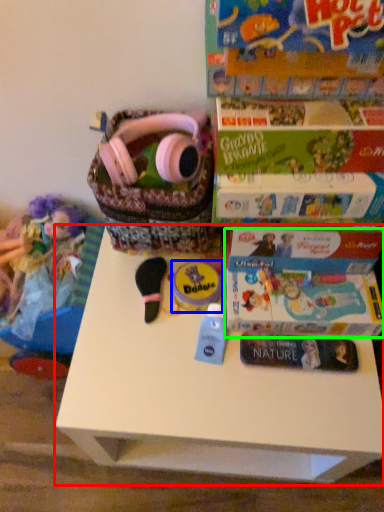
Question: Which is farther away from table (highlighted by a red box)? toy (highlighted by a blue box) or paperback book (highlighted by a green box)?

Choices:
 (A) toy
 (B) paperback book

Answer: (A)